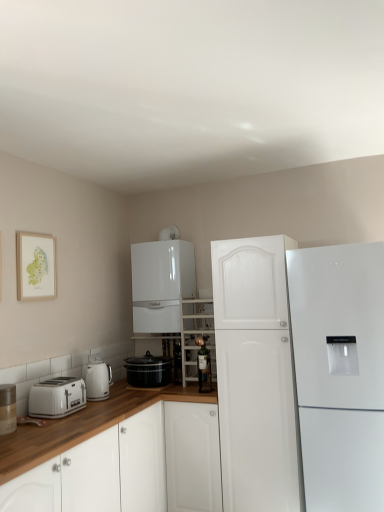
Question: Considering the relative sizes of white glossy cabinet at lower left and matte glass bottle at center in the image provided, is white glossy cabinet at lower left wider than matte glass bottle at center?

Choices:
 (A) no
 (B) yes

Answer: (B)

Question: Considering the relative sizes of white glossy cabinet at lower left and matte glass bottle at center in the image provided, is white glossy cabinet at lower left bigger than matte glass bottle at center?

Choices:
 (A) no
 (B) yes

Answer: (B)

Question: Is white glossy cabinet at lower left looking in the opposite direction of matte glass bottle at center?

Choices:
 (A) yes
 (B) no

Answer: (B)

Question: Would you say matte glass bottle at center is part of white glossy cabinet at lower left's contents?

Choices:
 (A) no
 (B) yes

Answer: (A)

Question: Can you confirm if white glossy cabinet at lower left is positioned to the right of matte glass bottle at center?

Choices:
 (A) no
 (B) yes

Answer: (A)

Question: From a real-world perspective, is clear glass shelves at center above or below black glossy slow cooker at lower center, marked as the first kitchen appliance in a right-to-left arrangement?

Choices:
 (A) above
 (B) below

Answer: (A)

Question: In terms of width, does clear glass shelves at center look wider or thinner when compared to black glossy slow cooker at lower center, which is the 2th kitchen appliance from left to right?

Choices:
 (A) wide
 (B) thin

Answer: (A)

Question: Based on their sizes in the image, would you say clear glass shelves at center is bigger or smaller than black glossy slow cooker at lower center, which is the 2th kitchen appliance from left to right?

Choices:
 (A) small
 (B) big

Answer: (B)

Question: Relative to black glossy slow cooker at lower center, which is the 2th kitchen appliance from left to right, is clear glass shelves at center in front or behind?

Choices:
 (A) front
 (B) behind

Answer: (B)

Question: From a real-world perspective, is white matte cabinet at center, the second refrigerator when ordered from left to right, positioned above or below white plastic toaster at lower left?

Choices:
 (A) above
 (B) below

Answer: (B)

Question: Looking at their shapes, would you say white matte cabinet at center, the second refrigerator when ordered from left to right, is wider or thinner than white plastic toaster at lower left?

Choices:
 (A) thin
 (B) wide

Answer: (B)

Question: Is point (241, 322) closer or farther from the camera than point (74, 398)?

Choices:
 (A) farther
 (B) closer

Answer: (A)

Question: Would you say white matte cabinet at center, acting as the 1th refrigerator starting from the right, is to the left or to the right of white plastic toaster at lower left in the picture?

Choices:
 (A) right
 (B) left

Answer: (A)

Question: Is matte silver canister at left spatially inside white matte cabinet at center, acting as the 1th refrigerator starting from the right, or outside of it?

Choices:
 (A) inside
 (B) outside

Answer: (B)

Question: Considering the positions of matte silver canister at left and white matte cabinet at center, the second refrigerator when ordered from left to right, in the image, is matte silver canister at left bigger or smaller than white matte cabinet at center, the second refrigerator when ordered from left to right,?

Choices:
 (A) small
 (B) big

Answer: (A)